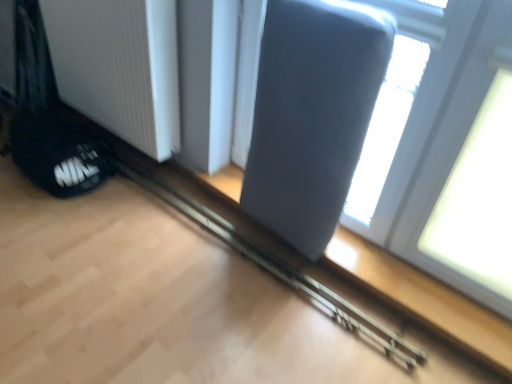
The width and height of the screenshot is (512, 384). I want to click on free space between black mesh shoe at lower left and metallic gray rail at center, so click(178, 241).